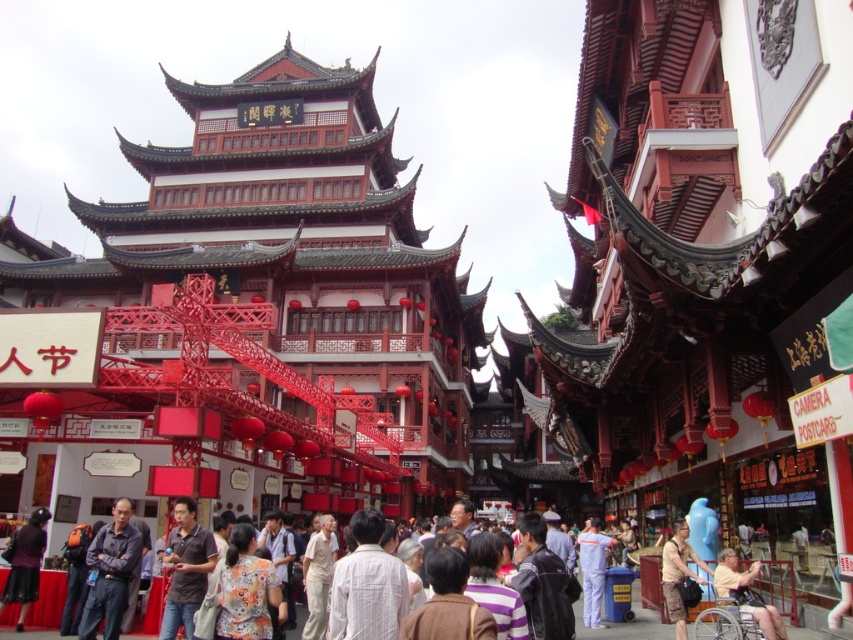
Does floral kimono at center come in front of dark purple shirt at center?

That is True.

Between point (270, 582) and point (123, 515), which one is positioned in front?

Positioned in front is point (270, 582).

Identify the location of floral kimono at center. This screenshot has height=640, width=853. (245, 589).

Which is below, floral kimono at center or leather jacket at center?

leather jacket at center is below.

Does point (219, 577) lie behind point (527, 611)?

Yes.

Is point (242, 564) positioned before point (525, 563)?

Yes.

Identify the location of floral kimono at center. (245, 589).

Does matte black dress at lower left have a greater width compared to brown fabric shirt at lower right?

Incorrect, matte black dress at lower left's width does not surpass brown fabric shirt at lower right's.

At what (x,y) coordinates should I click in order to perform the action: click on matte black dress at lower left. Please return your answer as a coordinate pair (x, y). The image size is (853, 640). Looking at the image, I should click on (24, 563).

What are the coordinates of `matte black dress at lower left` in the screenshot? It's located at (24, 563).

The width and height of the screenshot is (853, 640). Find the location of `matte black dress at lower left`. matte black dress at lower left is located at coordinates (24, 563).